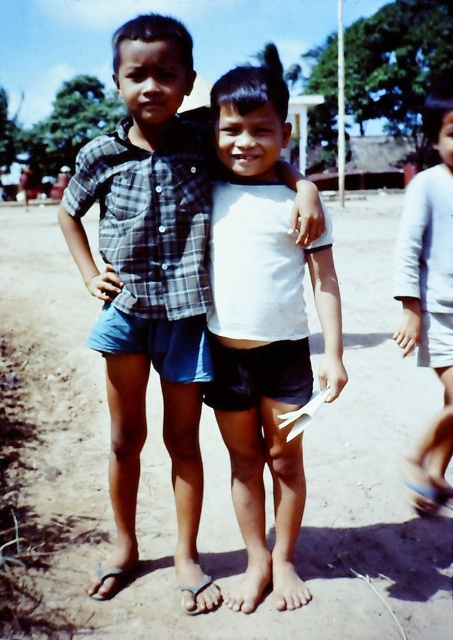
You are a photographer trying to capture a photo of the two children. You notice the brown sandy ground at center and the plaid fabric shirt at center. Which object is positioned to the right of the other?

The brown sandy ground at center is to the right of the plaid fabric shirt at center.

You are standing at the point labeled point [182,49] and want to take a photo of the two children. If your camera is 1.6 meters tall, will the photo capture both children fully?

The distance between point [182,49] and the camera is 2.45 meters. Since the camera is 1.6 meters tall, it is possible that the photo will capture both children fully, assuming they are within the camera frame and not obstructed.

You are taking a photo of two children standing outdoors. You notice two points in the image at coordinates point (366,316) and point (143,440). Which point is closer to the camera?

Point (366,316) is further to the camera than point (143,440), so the point closer to the camera is point (143,440).